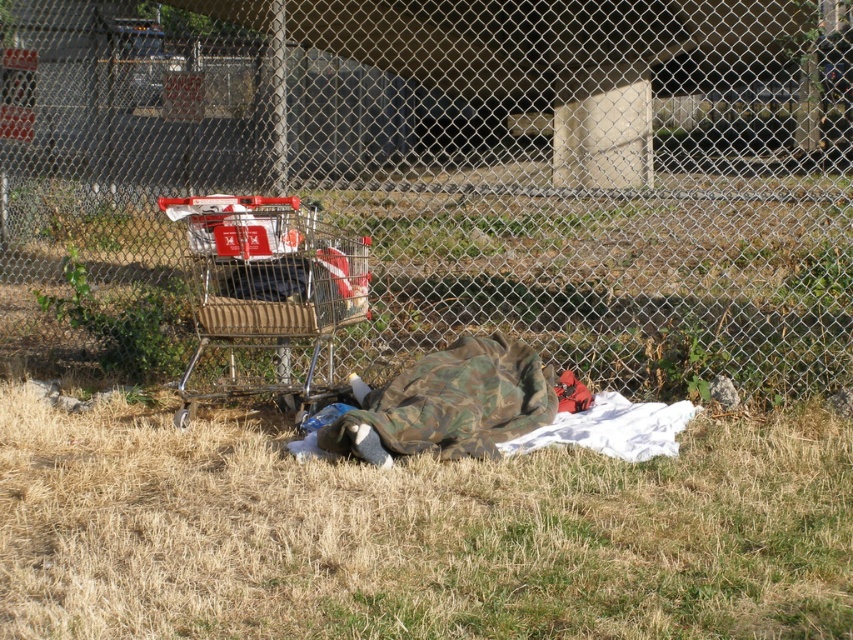
You are a delivery person who needs to place a package on the largest available flat surface in the scene. Which object should you choose between the green grass at lower center and the metallic silver shopping cart at upper left?

The green grass at lower center has a larger size compared to the metallic silver shopping cart at upper left, so you should choose the green grass at lower center to place the package.